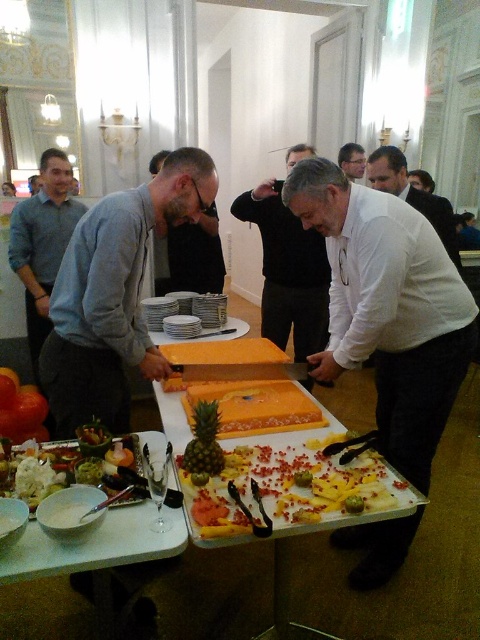
Question: Considering the relative positions of sliced pineapple at center and green textured pineapple at center in the image provided, where is sliced pineapple at center located with respect to green textured pineapple at center?

Choices:
 (A) right
 (B) left

Answer: (A)

Question: Estimate the real-world distances between objects in this image. Which object is closer to the white glossy bowls at center?

Choices:
 (A) ripe red tomato at lower left
 (B) matte gray sweater at center
 (C) matte gray shirt at left

Answer: (B)

Question: Is white matte shirt at center smaller than smooth black shirt at center?

Choices:
 (A) yes
 (B) no

Answer: (B)

Question: Which object is farther from the camera taking this photo?

Choices:
 (A) white matte shirt at center
 (B) green textured pineapple at center

Answer: (A)

Question: Which object is positioned closest to the yellow matte pineapple at center?

Choices:
 (A) white glossy bowls at center
 (B) white matte shirt at center
 (C) green textured pineapple at center
 (D) matte gray shirt at left

Answer: (C)

Question: In this image, where is white matte shirt at center located relative to dark gray shirt at center?

Choices:
 (A) above
 (B) below

Answer: (B)